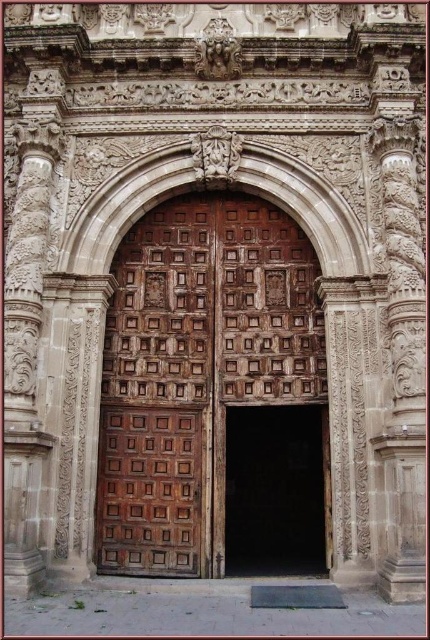
You are an architect examining the building entrance. You notice two doors at the center. Which one is closer to you, the wooden carved door at center or the brown wood door at center?

The wooden carved door at center is closer to you as it is positioned in front of the brown wood door at center.

You are standing in front of the grand entrance of a historical building. You need to locate the wooden carved door at center. Where exactly is it positioned in terms of coordinates?

The wooden carved door at center is located at coordinates point (x=196, y=371).